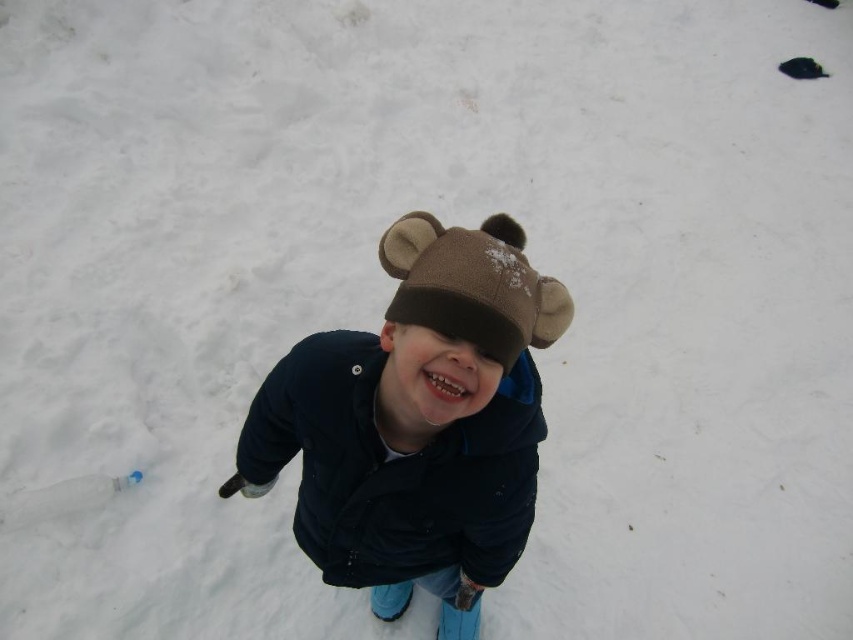
You are a photographer trying to capture the child wearing the dark blue fleece jacket at center in the image. If you want to focus on the jacket, where should you aim your camera?

You should aim your camera at point (416, 422) to focus on the dark blue fleece jacket at center.

You are a photographer trying to capture the child in the center wearing the dark blue fleece jacket at center. The camera is set to focus on the point at coordinates point (416, 422). Will the focus point be on the child?

Yes, the focus point at point (416, 422) is on the dark blue fleece jacket at center, so the focus will be on the child.